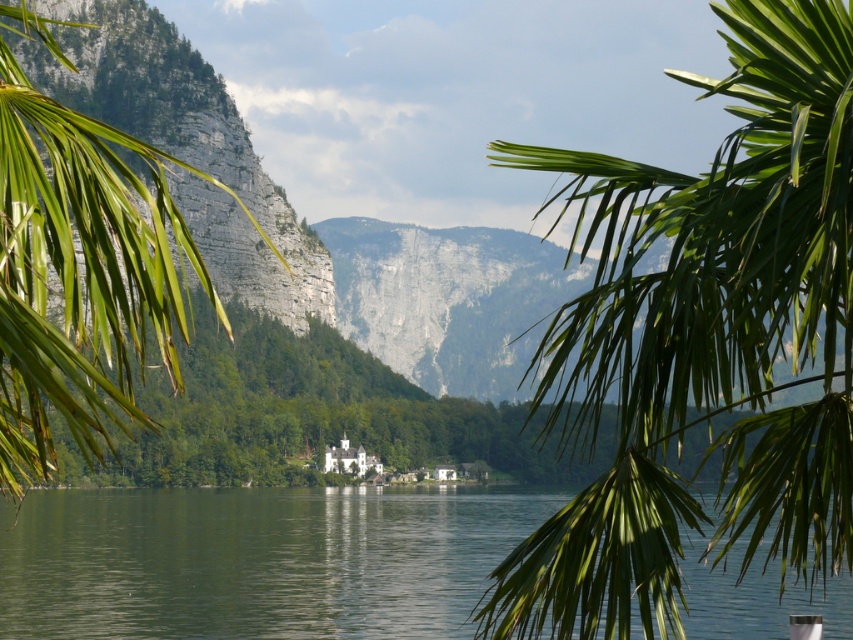
Question: Does green leafy palm tree at upper right have a smaller size compared to green leafy palm tree at left?

Choices:
 (A) no
 (B) yes

Answer: (B)

Question: Can you confirm if green leafy palm tree at upper right is positioned below green water at center?

Choices:
 (A) yes
 (B) no

Answer: (B)

Question: Does green leafy palm tree at upper right have a lesser width compared to green water at center?

Choices:
 (A) yes
 (B) no

Answer: (A)

Question: Considering the real-world distances, which object is closest to the green leafy palm tree at left?

Choices:
 (A) green water at center
 (B) green leafy palm tree at upper right

Answer: (A)

Question: Which point is farther to the camera?

Choices:
 (A) (86, 285)
 (B) (724, 538)
 (C) (213, 636)

Answer: (C)

Question: Which of the following is the farthest from the observer?

Choices:
 (A) (737, 472)
 (B) (97, 172)
 (C) (141, 630)

Answer: (C)